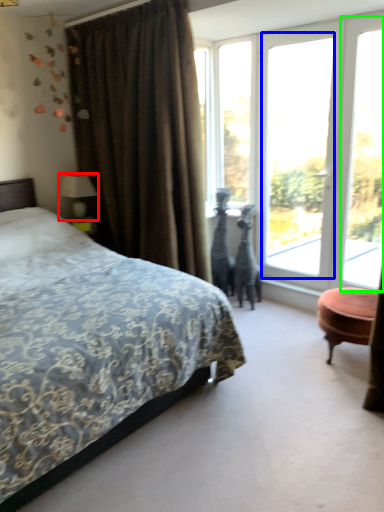
Question: Which object is the closest to the table lamp (highlighted by a red box)? Choose among these: window (highlighted by a blue box) or window screen (highlighted by a green box).

Choices:
 (A) window
 (B) window screen

Answer: (A)